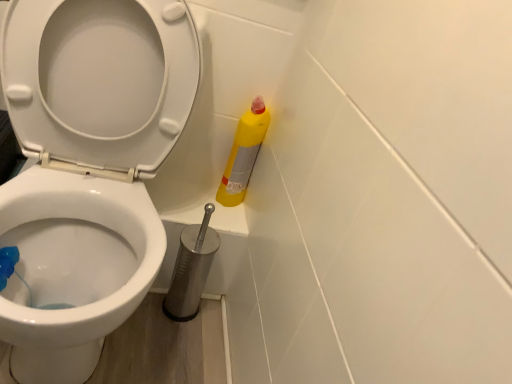
Question: Based on their sizes in the image, would you say yellow matte bottle at right is bigger or smaller than white glossy toilet at center?

Choices:
 (A) small
 (B) big

Answer: (A)

Question: Considering the positions of yellow matte bottle at right and white glossy toilet at center in the image, is yellow matte bottle at right taller or shorter than white glossy toilet at center?

Choices:
 (A) short
 (B) tall

Answer: (A)

Question: Which object is the farthest from the white glossy toilet at center?

Choices:
 (A) yellow matte bottle at right
 (B) metallic silver toilet brush at lower center

Answer: (A)

Question: Which of these objects is positioned farthest from the yellow matte bottle at right?

Choices:
 (A) metallic silver toilet brush at lower center
 (B) white glossy toilet at center

Answer: (B)